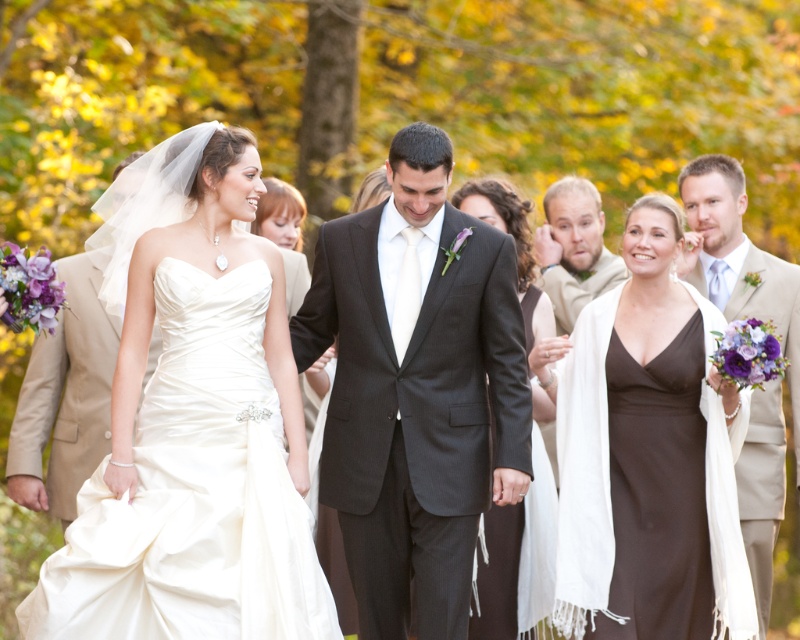
How distant is matte black suit at center from brown satin dress at center?

matte black suit at center and brown satin dress at center are 90.51 centimeters apart from each other.

Is matte black suit at center taller than brown satin dress at center?

Yes, matte black suit at center is taller than brown satin dress at center.

Is point (385, 440) in front of point (633, 342)?

Yes, it is.

Where is `matte black suit at center`? The width and height of the screenshot is (800, 640). matte black suit at center is located at coordinates (416, 388).

Is satin dress at center behind matte black dress at center?

No, it is not.

Can you confirm if satin dress at center is taller than matte black dress at center?

Incorrect, satin dress at center's height is not larger of matte black dress at center's.

Which is in front, point (306, 547) or point (498, 196)?

Point (306, 547) is more forward.

At what (x,y) coordinates should I click in order to perform the action: click on satin dress at center. Please return your answer as a coordinate pair (x, y). Looking at the image, I should click on (193, 424).

Does matte black suit at center have a lesser height compared to light brown hair at upper center?

No.

Can you confirm if matte black suit at center is thinner than light brown hair at upper center?

In fact, matte black suit at center might be wider than light brown hair at upper center.

Where is `matte black suit at center`? The image size is (800, 640). matte black suit at center is located at coordinates (416, 388).

At what (x,y) coordinates should I click in order to perform the action: click on matte black suit at center. Please return your answer as a coordinate pair (x, y). Looking at the image, I should click on (416, 388).